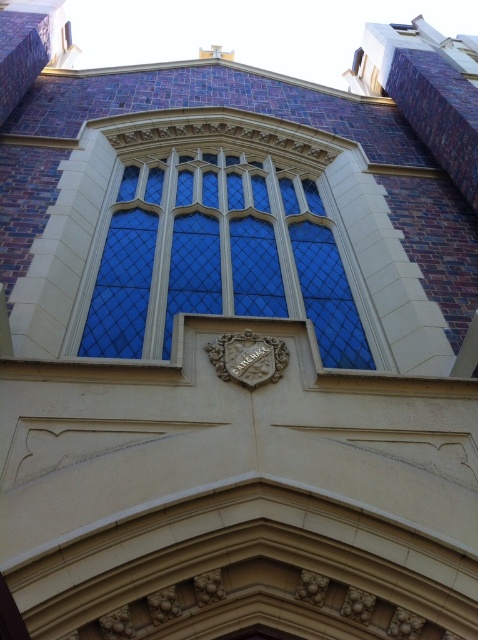
You are an architect examining the cathedral facade. You observe the blue glass window at center and the stone carved crest at center. Which object is positioned higher on the building?

The blue glass window at center is above the stone carved crest at center, so it is positioned higher on the building.

You are an architect analyzing the cathedral facade. You notice the blue glass window at center and the stone carved crest at center. Based on their positions, which object is positioned to the right side of the other?

The blue glass window at center is to the left of the stone carved crest at center, so the stone carved crest at center is positioned to the right of the blue glass window at center.